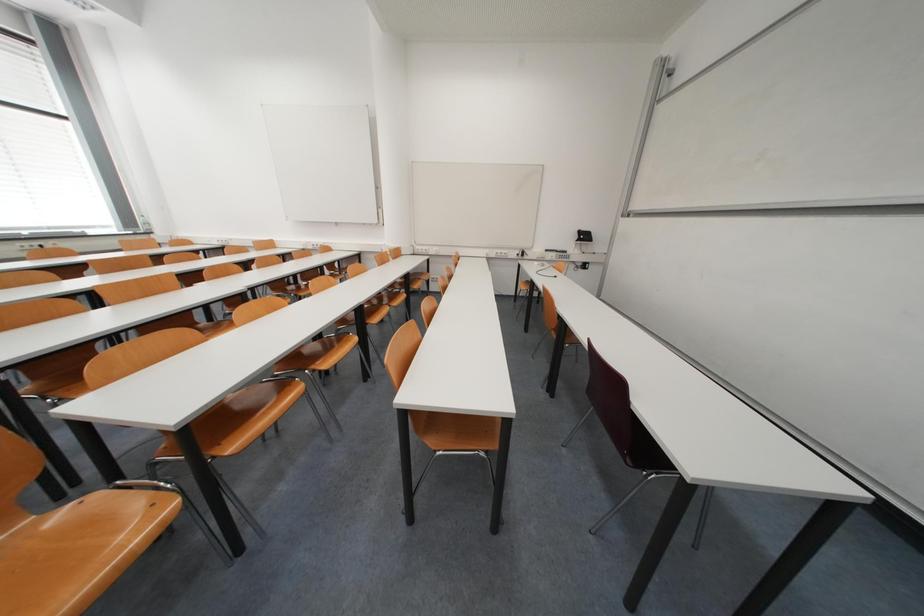
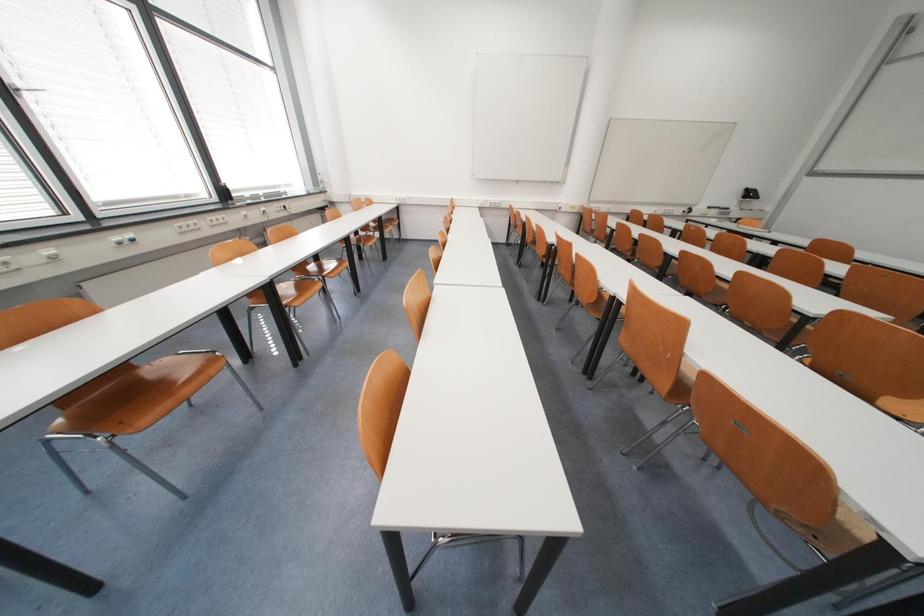
Question: What movement of the cameraman would produce the second image?

Choices:
 (A) Left
 (B) Right
 (C) Forward
 (D) Backward

Answer: (A)